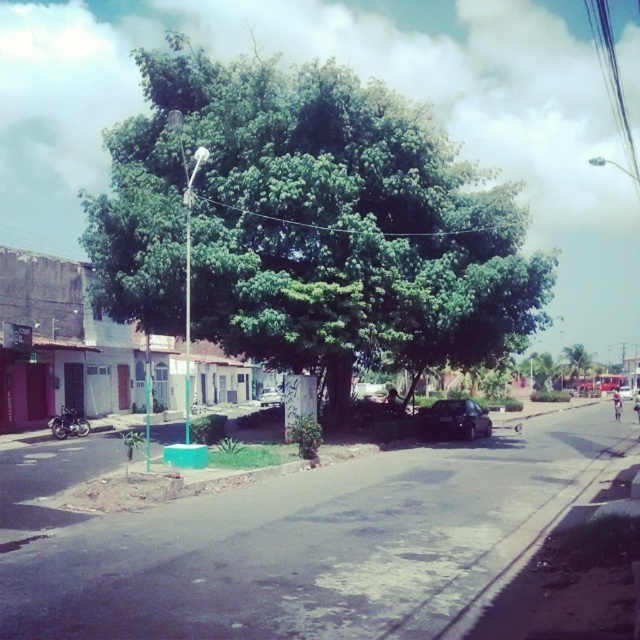
You are a pedestrian standing on the street and want to walk from the green leafy tree at center to the black matte car at center. Which direction should you walk to reach the car?

The green leafy tree at center is above the black matte car at center, so you should walk downward to reach the car.

You are standing at the corner of the street where the red door building is located. You want to walk straight towards the green leafy tree at center. Will you have to walk past any buildings before reaching the tree?

Since the green leafy tree at center is located at the center of the frame and you are starting from the corner near the red door building, you would not need to walk past any buildings before reaching the tree. The tree is positioned centrally in the street, so your path would be clear.

You are a delivery driver who needs to park your car in this street scene. You have a black matte car at center and a silver metallic car at center. Which car would require less space to park?

The black matte car at center has a smaller size compared to the silver metallic car at center, so it would require less space to park.